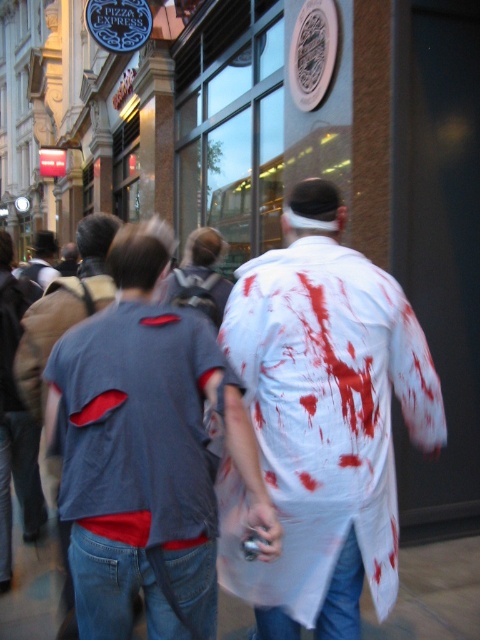
Question: Does denim shirt at center have a greater width compared to gray fabric shirt at center?

Choices:
 (A) no
 (B) yes

Answer: (A)

Question: Which object is the closest to the denim shirt at center?

Choices:
 (A) white matte shirt at center
 (B) gray fabric shirt at center

Answer: (A)

Question: Which point is farther to the camera?

Choices:
 (A) matte gray t-shirt at center
 (B) white matte shirt at center
 (C) denim shirt at center
 (D) gray fabric shirt at center

Answer: (D)

Question: Which object appears farthest from the camera in this image?

Choices:
 (A) denim shirt at center
 (B) gray fabric shirt at center

Answer: (B)

Question: Where is white matte shirt at center located in relation to gray fabric shirt at center in the image?

Choices:
 (A) below
 (B) above

Answer: (A)

Question: Is matte gray t-shirt at center positioned in front of gray fabric shirt at center?

Choices:
 (A) yes
 (B) no

Answer: (A)